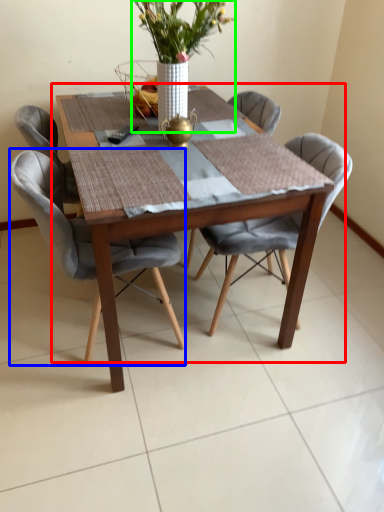
Question: Which object is the closest to the kitchen & dining room table (highlighted by a red box)? Choose among these: chair (highlighted by a blue box) or houseplant (highlighted by a green box).

Choices:
 (A) chair
 (B) houseplant

Answer: (A)